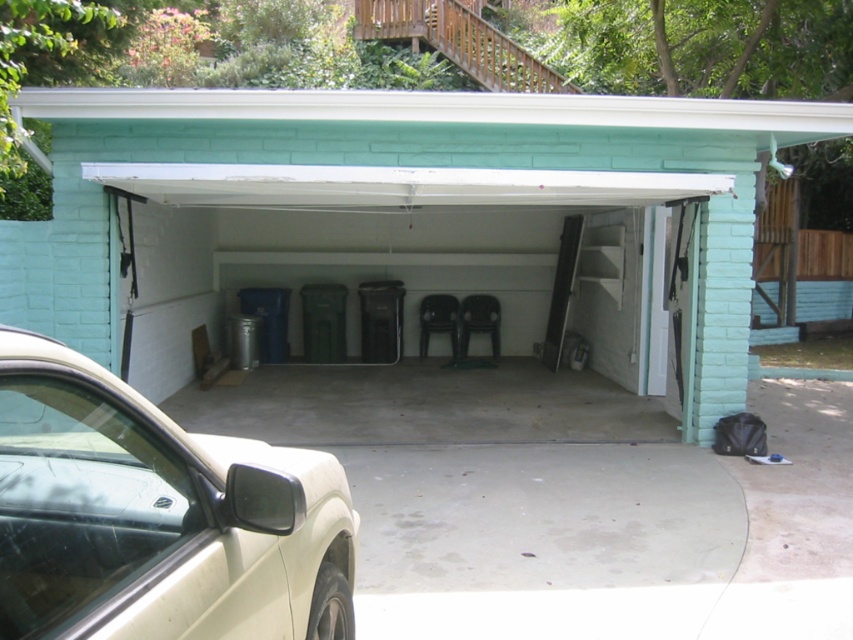
Question: Which object appears closest to the camera in this image?

Choices:
 (A) white plastic chairs at center
 (B) beige matte car at lower left

Answer: (B)

Question: From the image, what is the correct spatial relationship of white plastic chairs at center in relation to beige matte car at lower left?

Choices:
 (A) above
 (B) below

Answer: (A)

Question: Which point is closer to the camera?

Choices:
 (A) beige matte car at lower left
 (B) white plastic chairs at center

Answer: (A)

Question: Does white plastic chairs at center have a lesser width compared to beige matte car at lower left?

Choices:
 (A) no
 (B) yes

Answer: (A)

Question: Does white plastic chairs at center appear under beige matte car at lower left?

Choices:
 (A) yes
 (B) no

Answer: (B)